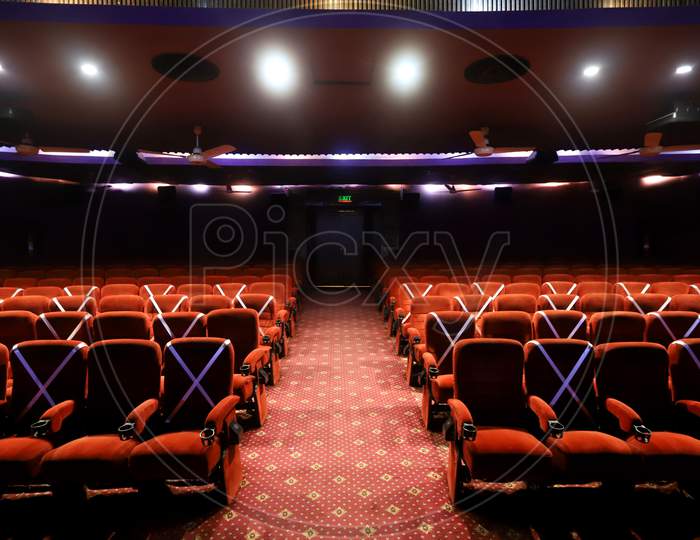
Locate an element on the screen. This screenshot has width=700, height=540. lights is located at coordinates (1, 67), (85, 63), (278, 68), (427, 74), (589, 75), (686, 73).